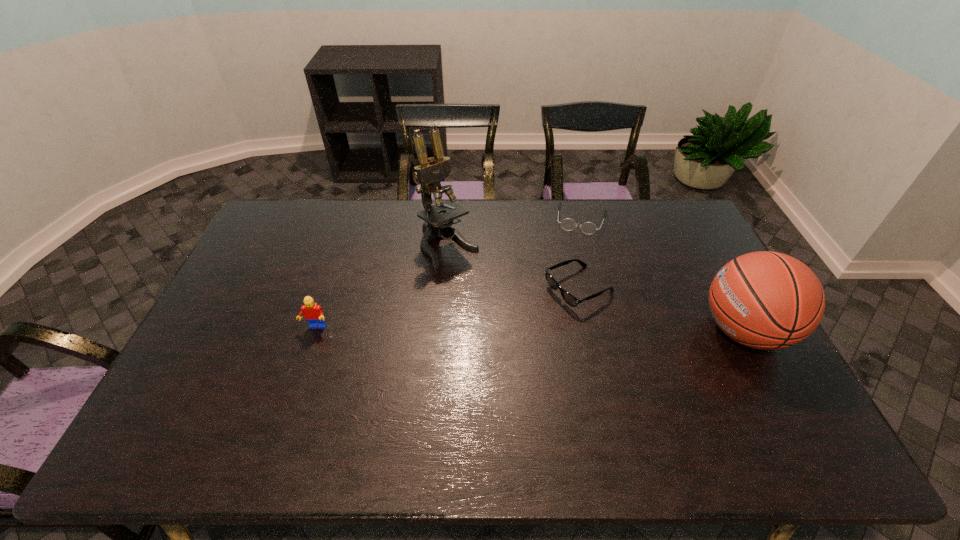
At what (x,y) coordinates should I click in order to perform the action: click on vacant space located 0.140m on the logo side of the fourth shortest object. Please return your answer as a coordinate pair (x, y). The height and width of the screenshot is (540, 960). Looking at the image, I should click on (650, 330).

Where is `free point located 0.310m on the logo side of the fourth shortest object`? free point located 0.310m on the logo side of the fourth shortest object is located at coordinates (592, 330).

Image resolution: width=960 pixels, height=540 pixels. I want to click on vacant space located 0.360m on the logo side of the fourth shortest object, so click(575, 330).

Locate an element on the screen. The width and height of the screenshot is (960, 540). vacant area located at the eyepieces of the tallest object is located at coordinates (499, 301).

Locate an element on the screen. The image size is (960, 540). free location located at the eyepieces of the tallest object is located at coordinates (507, 309).

Where is `vacant space located 0.210m at the eyepieces of the tallest object`? This screenshot has width=960, height=540. vacant space located 0.210m at the eyepieces of the tallest object is located at coordinates (503, 305).

This screenshot has height=540, width=960. I want to click on vacant space located 0.330m on the lenses of the nearer spectacles, so click(x=459, y=348).

The width and height of the screenshot is (960, 540). What are the coordinates of `vacant space located on the lenses of the nearer spectacles` in the screenshot? It's located at pos(492,332).

Locate an element on the screen. This screenshot has height=540, width=960. vacant space located 0.170m on the lenses of the nearer spectacles is located at coordinates point(506,325).

Image resolution: width=960 pixels, height=540 pixels. What are the coordinates of `vacant space located through the lenses of the shortest object` in the screenshot? It's located at (561, 312).